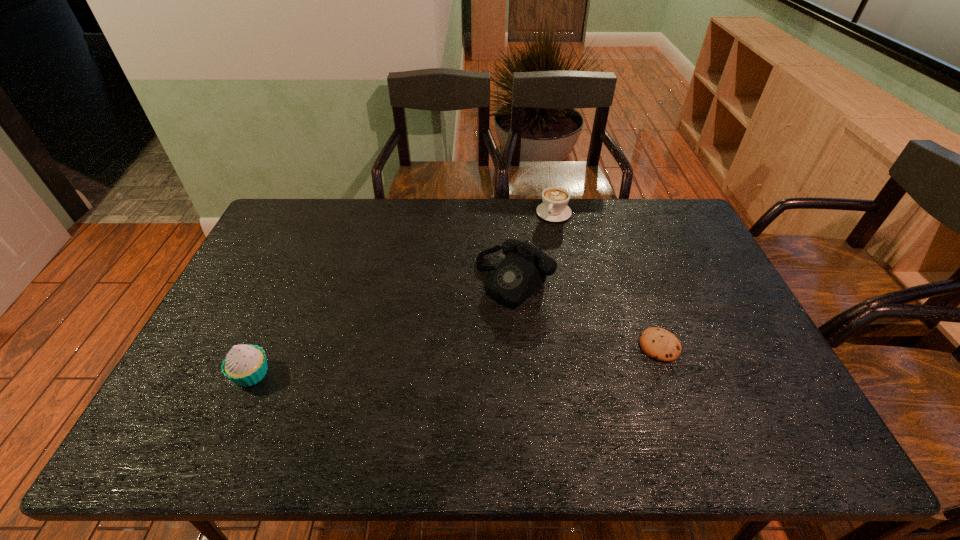
You are a GUI agent. You are given a task and a screenshot of the screen. Output one action in this format:
    pyautogui.click(x=<x>, y=<y>)
    Task: Click on the free spot on the desktop that is between the leftmost object and the rightmost object and is positioned on the dial of the second farthest object
    
    Given the screenshot: What is the action you would take?
    pyautogui.click(x=424, y=362)

What are the coordinates of `vacant space on the desktop that is between the leftmost object and the rightmost object and is positioned to the right of the third tallest object's handle` in the screenshot? It's located at (485, 358).